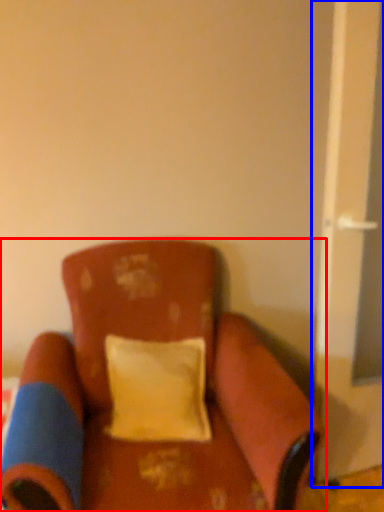
Question: Among these objects, which one is farthest to the camera, chair (highlighted by a red box) or screen door (highlighted by a blue box)?

Choices:
 (A) chair
 (B) screen door

Answer: (B)